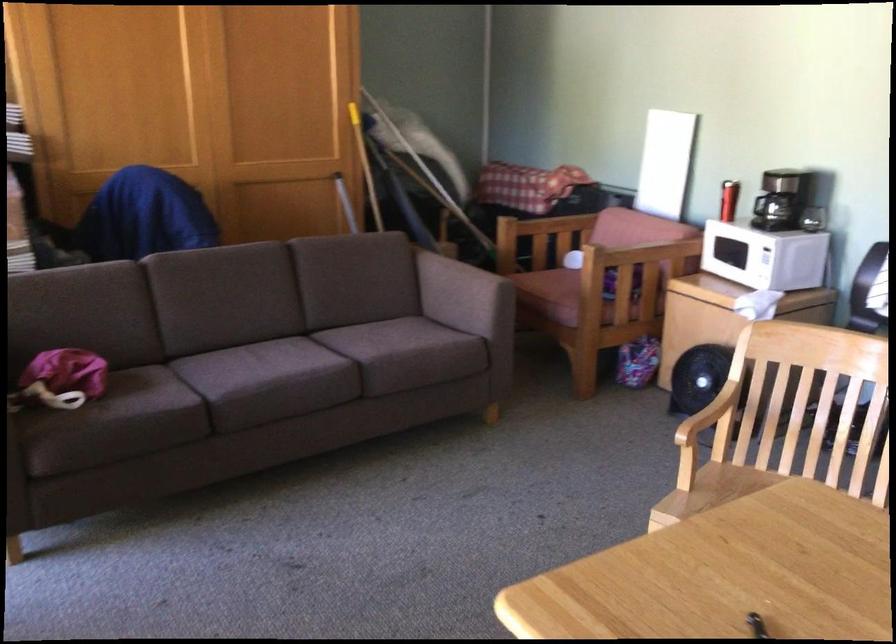
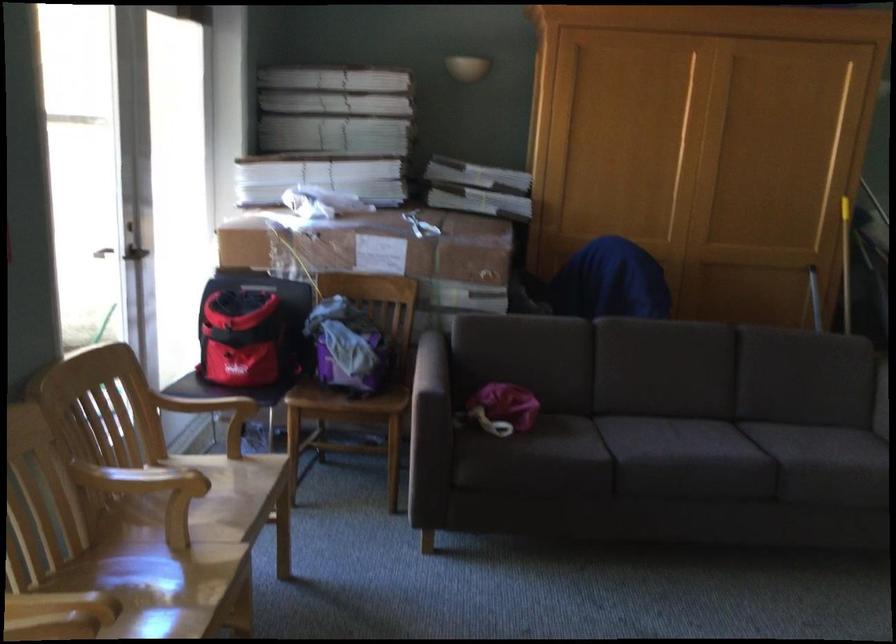
Find the pixel in the second image that matches point 294,355 in the first image.

(724, 439)